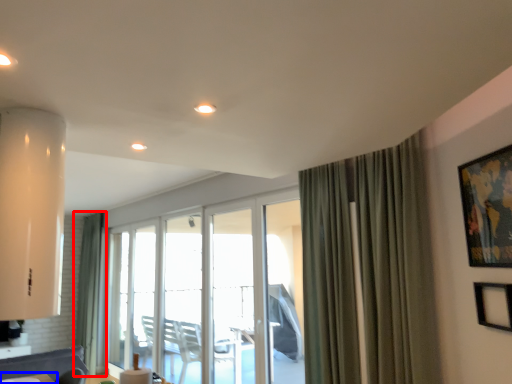
Question: Which object is further to the camera taking this photo, curtain (highlighted by a red box) or table (highlighted by a blue box)?

Choices:
 (A) curtain
 (B) table

Answer: (A)